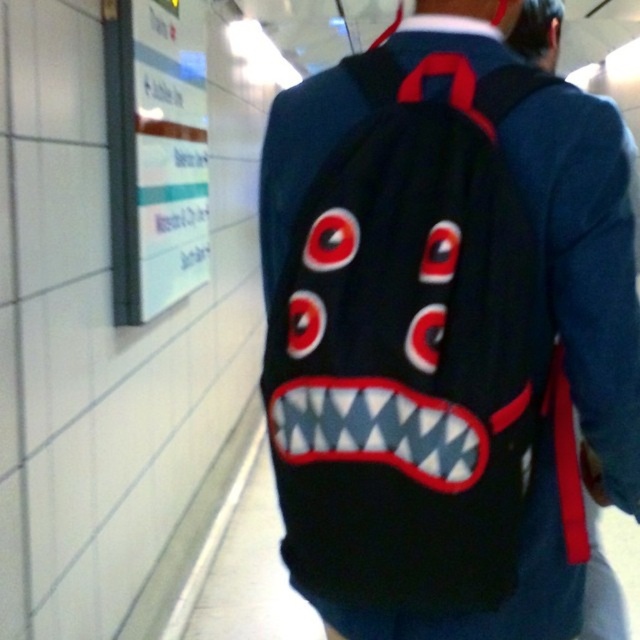
You are a security guard in the subway station. You need to locate the black fabric backpack at upper center. Where exactly is it positioned in the image?

The black fabric backpack at upper center is positioned at point (448, 328) in the image.

You are a security guard at the subway station and you need to check the distance between the black fabric backpack at upper center and the white glossy signboard at upper left. Can you determine which object is closer to the entrance of the subway station?

The black fabric backpack at upper center is to the right of the white glossy signboard at upper left, so the backpack is closer to the entrance than the signboard.

You are a security guard in the subway station. You need to determine if the black fabric backpack at upper center can fit vertically into a storage locker that is the same height as the white glossy signboard at upper left. Can it fit?

The black fabric backpack at upper center is not as tall as the white glossy signboard at upper left, so it can fit vertically into the storage locker.